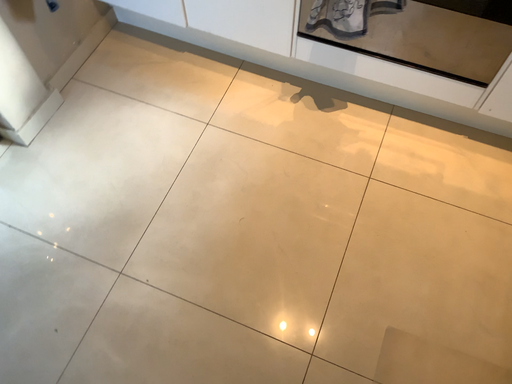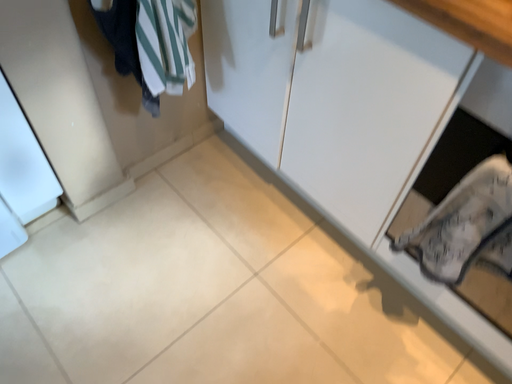
Question: Which way did the camera rotate in the video?

Choices:
 (A) rotated right
 (B) rotated left

Answer: (B)